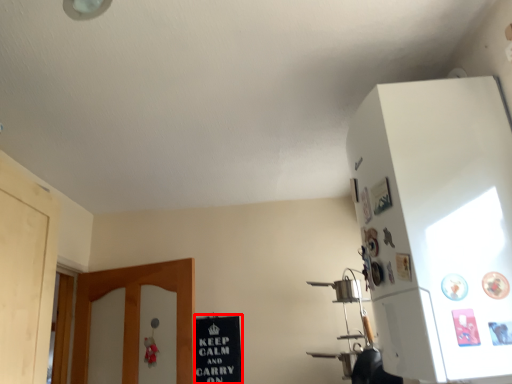
Question: Where is bulletin board (annotated by the red box) located in relation to cabinetry in the image?

Choices:
 (A) left
 (B) right

Answer: (A)